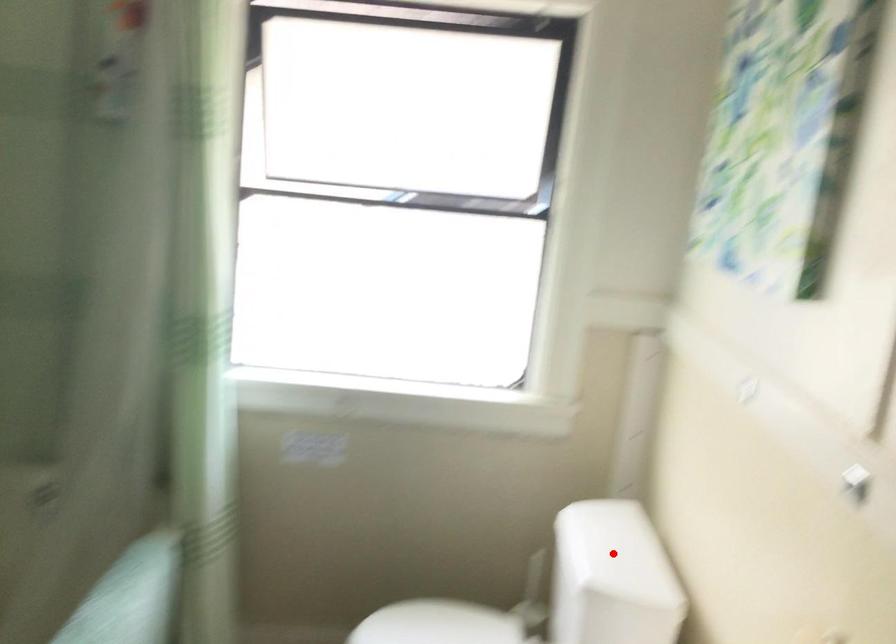
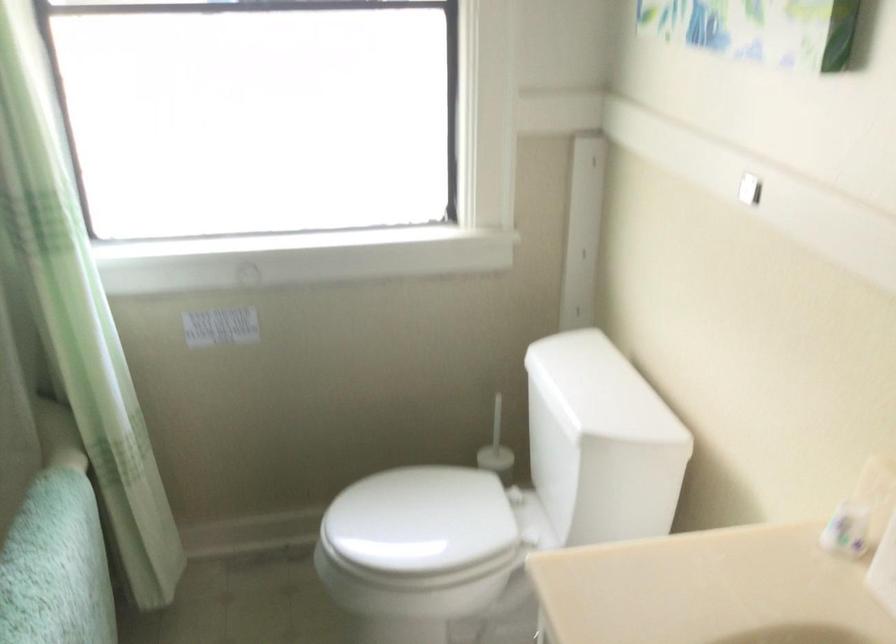
Question: I am providing you with two images of the same scene from different viewpoints. Given a red point in image1, look at the same physical point in image2. Is it:

Choices:
 (A) Closer to the viewpoint
 (B) Farther from the viewpoint

Answer: (A)